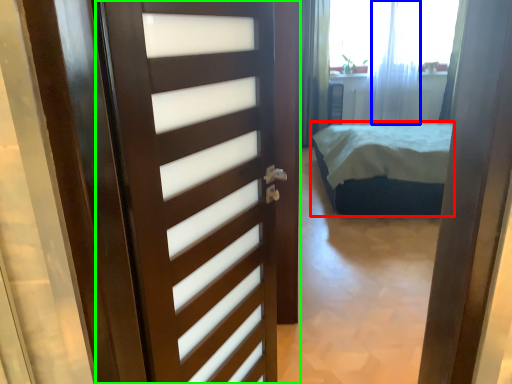
Question: Estimate the real-world distances between objects in this image. Which object is closer to bed (highlighted by a red box), curtain (highlighted by a blue box) or door (highlighted by a green box)?

Choices:
 (A) curtain
 (B) door

Answer: (A)